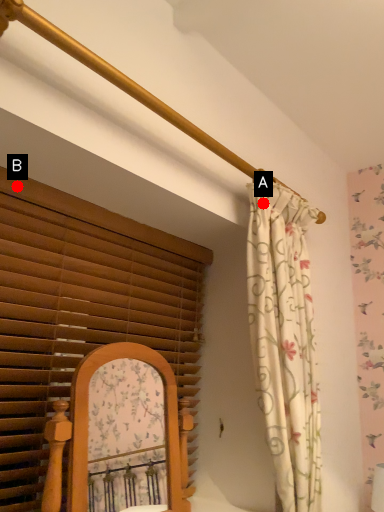
Question: Two points are circled on the image, labeled by A and B beside each circle. Which point is farther to the camera?

Choices:
 (A) A is further
 (B) B is further

Answer: (A)